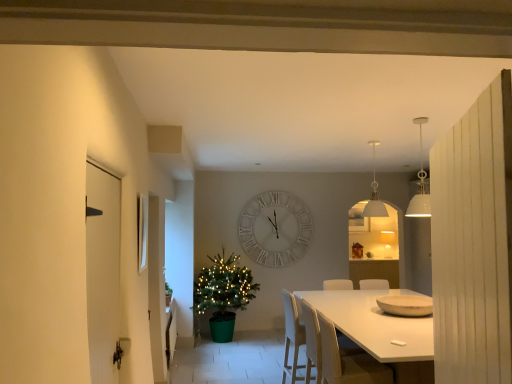
Where is `white glossy door at left`? white glossy door at left is located at coordinates point(102,270).

What is the approximate height of white glossy door at left?

white glossy door at left is 3.94 feet tall.

In order to face green matte houseplant at left, should I rotate leftwards or rightwards?

Rotate your view left by about 11.784°.

Find the location of `white glossy door at left`. white glossy door at left is located at coordinates (102, 270).

Is point (400, 309) closer or farther from the camera than point (385, 255)?

Point (400, 309) is closer to the camera than point (385, 255).

Is wooden bowl at center positioned with its back to matte white lampshade at upper center, the first lamp in the right-to-left sequence?

wooden bowl at center is not turned away from matte white lampshade at upper center, the first lamp in the right-to-left sequence.

Where is `lamp that is the 1st one above the wooden bowl at center (from a real-world perspective)`? lamp that is the 1st one above the wooden bowl at center (from a real-world perspective) is located at coordinates (388, 243).

Considering the positions of objects wooden bowl at center and matte white lampshade at upper center, the first lamp in the right-to-left sequence, in the image provided, who is in front, wooden bowl at center or matte white lampshade at upper center, the first lamp in the right-to-left sequence,?

Positioned in front is wooden bowl at center.

In the scene shown: From the image's perspective, is white matte pendant light at upper center, arranged as the second lamp when viewed from the back, beneath wooden bowl at center?

No.

Does point (375, 140) come farther from viewer compared to point (396, 310)?

Yes, point (375, 140) is behind point (396, 310).

Which object is wider, white matte pendant light at upper center, which ranks as the 2th lamp in right-to-left order, or wooden bowl at center?

wooden bowl at center is wider.

Is wooden bowl at center completely or partially inside white matte pendant light at upper center, arranged as the second lamp when viewed from the back?

Actually, wooden bowl at center is outside white matte pendant light at upper center, arranged as the second lamp when viewed from the back.

Is white matte chair at center, the first armchair viewed from the back, spatially inside white matte pendant light at upper center, arranged as the second lamp when viewed from the back, or outside of it?

white matte chair at center, the first armchair viewed from the back, is located beyond the bounds of white matte pendant light at upper center, arranged as the second lamp when viewed from the back.

Is white matte chair at center, the first armchair viewed from the back, positioned with its back to white matte pendant light at upper center, arranged as the second lamp when viewed from the back?

white matte chair at center, the first armchair viewed from the back, does not have its back to white matte pendant light at upper center, arranged as the second lamp when viewed from the back.

From a real-world perspective, is white matte chair at center, acting as the second armchair starting from the front, below white matte pendant light at upper center, placed as the 2th lamp when sorted from bottom to top?

Yes, from a real-world perspective, white matte chair at center, acting as the second armchair starting from the front, is under white matte pendant light at upper center, placed as the 2th lamp when sorted from bottom to top.

Can you confirm if white matte chair at center, the first armchair viewed from the back, is taller than white matte pendant light at upper center, arranged as the second lamp when viewed from the back?

Yes.

Is white plastic chair at center inside white glossy table at center?

Yes, white plastic chair at center is a part of white glossy table at center.

From the picture: Can you tell me how much white glossy table at center and white plastic chair at center differ in facing direction?

The angle between the facing direction of white glossy table at center and the facing direction of white plastic chair at center is 177 degrees.

Can you confirm if white glossy table at center is positioned to the right of white plastic chair at center?

Correct, you'll find white glossy table at center to the right of white plastic chair at center.

Considering the sizes of objects white glossy table at center and white plastic chair at center in the image provided, who is thinner, white glossy table at center or white plastic chair at center?

white plastic chair at center.

Considering their positions, is white glossy picture frame at upper left located in front of or behind white matte chair at center, acting as the second armchair starting from the front?

Clearly, white glossy picture frame at upper left is in front of white matte chair at center, acting as the second armchair starting from the front.

From a real-world perspective, is white glossy picture frame at upper left over white matte chair at center, acting as the second armchair starting from the front?

Yes, from a real-world perspective, white glossy picture frame at upper left is above white matte chair at center, acting as the second armchair starting from the front.

Who is smaller, white glossy picture frame at upper left or white matte chair at center, acting as the second armchair starting from the front?

With smaller size is white glossy picture frame at upper left.

Does white glossy picture frame at upper left turn towards white matte chair at center, acting as the second armchair starting from the front?

No, white glossy picture frame at upper left is not turned towards white matte chair at center, acting as the second armchair starting from the front.

Could you tell me if white glossy table at center is facing white glossy door at left?

No, white glossy table at center is not turned towards white glossy door at left.

Considering the sizes of white glossy table at center and white glossy door at left in the image, is white glossy table at center bigger or smaller than white glossy door at left?

white glossy table at center is bigger than white glossy door at left.

From a real-world perspective, which object rests below the other?

white glossy table at center is physically lower.

Considering the positions of objects white glossy table at center and white glossy door at left in the image provided, who is more to the right, white glossy table at center or white glossy door at left?

white glossy table at center.

Does light brown wooden chair at lower center, the second armchair when ordered from back to front, have a larger size compared to white wooden clock at center?

Actually, light brown wooden chair at lower center, the second armchair when ordered from back to front, might be smaller than white wooden clock at center.

Is light brown wooden chair at lower center, positioned as the first armchair in front-to-back order, facing towards white wooden clock at center?

No, light brown wooden chair at lower center, positioned as the first armchair in front-to-back order, is not oriented towards white wooden clock at center.

From the image's perspective, relative to white wooden clock at center, is light brown wooden chair at lower center, the second armchair when ordered from back to front, above or below?

Clearly, from the image's perspective, light brown wooden chair at lower center, the second armchair when ordered from back to front, is below white wooden clock at center.

Is the depth of light brown wooden chair at lower center, the second armchair when ordered from back to front, less than that of white wooden clock at center?

That is True.

Identify the location of bowl that appears below the matte white lampshade at upper center, the first lamp from the bottom (from a real-world perspective). Image resolution: width=512 pixels, height=384 pixels. (406, 305).

You are a GUI agent. You are given a task and a screenshot of the screen. Output one action in this format:
    pyautogui.click(x=<x>, y=<y>)
    Task: Click on the lamp on the left of the wooden bowl at center
    Image resolution: width=512 pixels, height=384 pixels.
    Given the screenshot: What is the action you would take?
    pyautogui.click(x=374, y=194)

Looking at the image, which one is located closer to white wooden clock at center, white glossy table at center or white matte chair at center, the first armchair viewed from the back?

white glossy table at center lies closer to white wooden clock at center than the other object.

Which object lies nearer to the anchor point white glossy door at left, green matte houseplant at left or white wooden clock at center?

green matte houseplant at left is positioned closer to the anchor white glossy door at left.

Which object lies nearer to the anchor point green plastic christmas tree at center-left, white matte chair at center, acting as the second armchair starting from the front, or white glossy picture frame at upper left?

Based on the image, white matte chair at center, acting as the second armchair starting from the front, appears to be nearer to green plastic christmas tree at center-left.

From the image, which object appears to be nearer to light brown wooden chair at lower center, the second armchair when ordered from back to front, white glossy door at left or white wooden clock at center?

Among the two, white glossy door at left is located nearer to light brown wooden chair at lower center, the second armchair when ordered from back to front.

In the scene shown: From the image, which object appears to be farther from wooden bowl at center, white wooden clock at center or matte white lampshade at upper center, the 2th lamp when ordered from front to back?

Based on the image, white wooden clock at center appears to be further to wooden bowl at center.

Based on their spatial positions, is white plastic chair at center or white matte pendant light at upper center, the 1th lamp from the front, closer to light brown wooden chair at lower center, the second armchair when ordered from back to front?

white plastic chair at center is closer to light brown wooden chair at lower center, the second armchair when ordered from back to front.

From the image, which object appears to be farther from green plastic christmas tree at center-left, green matte houseplant at left or white glossy picture frame at upper left?

white glossy picture frame at upper left is positioned further to the anchor green plastic christmas tree at center-left.

Looking at the image, which one is located closer to white glossy table at center, light brown wooden chair at lower center, the second armchair when ordered from back to front, or wooden bowl at center?

light brown wooden chair at lower center, the second armchair when ordered from back to front, is closer to white glossy table at center.

I want to click on bowl between light brown wooden chair at lower center, positioned as the first armchair in front-to-back order, and green plastic christmas tree at center-left, along the z-axis, so click(406, 305).

You are a GUI agent. You are given a task and a screenshot of the screen. Output one action in this format:
    pyautogui.click(x=<x>, y=<y>)
    Task: Click on the chair between white glossy picture frame at upper left and matte white lampshade at upper center, which appears as the 2th lamp when viewed from the left, in the front-back direction
    
    Given the screenshot: What is the action you would take?
    pyautogui.click(x=292, y=336)

You are a GUI agent. You are given a task and a screenshot of the screen. Output one action in this format:
    pyautogui.click(x=<x>, y=<y>)
    Task: Click on the chair positioned between white matte chair at center, acting as the second armchair starting from the front, and white wooden clock at center from near to far
    This screenshot has width=512, height=384.
    Given the screenshot: What is the action you would take?
    pyautogui.click(x=292, y=336)

Identify the location of kitchen & dining room table between white glossy door at left and green plastic christmas tree at center-left in the front-back direction. This screenshot has height=384, width=512. (380, 330).